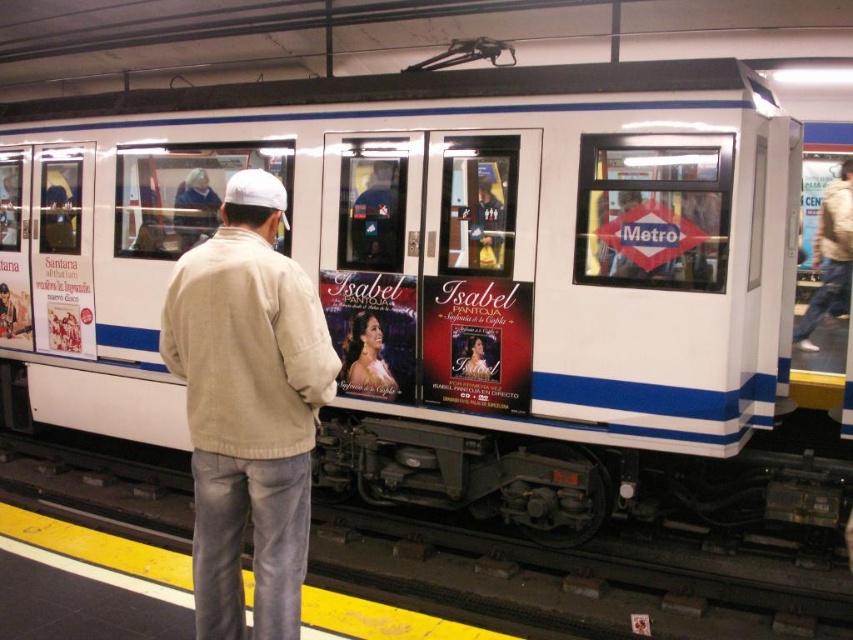
Does light brown jacket at right appear over light beige jacket at center?

Actually, light brown jacket at right is below light beige jacket at center.

Who is more forward, (837, 280) or (209, 220)?

Point (209, 220) is more forward.

Locate an element on the screen. light brown jacket at right is located at coordinates (830, 257).

Locate an element on the screen. The height and width of the screenshot is (640, 853). beige cotton jacket at center is located at coordinates (248, 406).

Which is behind, point (271, 456) or point (360, 387)?

Positioned behind is point (360, 387).

Measure the distance between beige cotton jacket at center and camera.

8.34 feet

The width and height of the screenshot is (853, 640). I want to click on beige cotton jacket at center, so click(x=248, y=406).

Does beige cotton jacket at center have a greater width compared to light brown jacket at right?

No.

Does beige cotton jacket at center have a larger size compared to light brown jacket at right?

No, beige cotton jacket at center is not bigger than light brown jacket at right.

Between point (299, 504) and point (815, 252), which one is positioned behind?

The point (815, 252) is more distant.

This screenshot has height=640, width=853. In order to click on beige cotton jacket at center in this screenshot , I will do `click(248, 406)`.